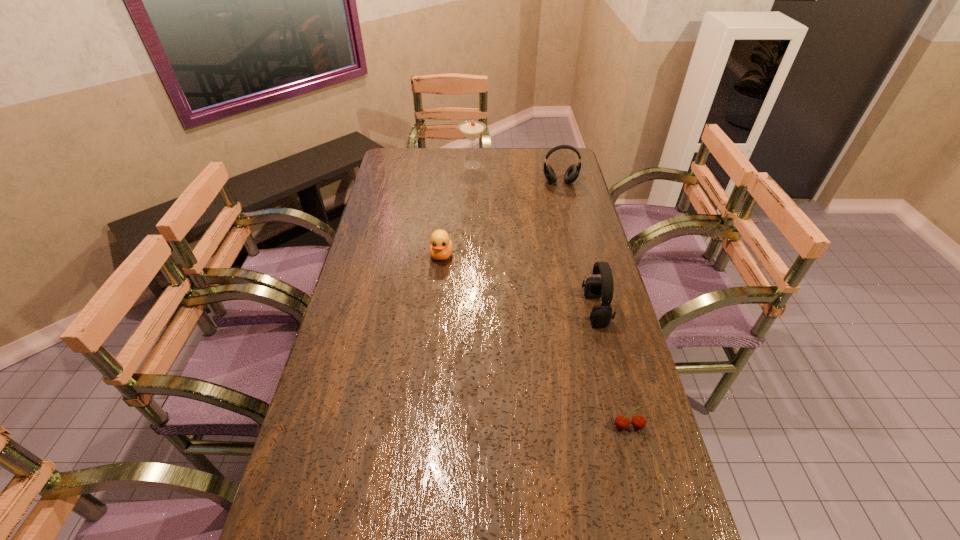
Identify the location of vacant region at the far right corner of the desktop. The image size is (960, 540). (563, 160).

Find the location of a particular element. The image size is (960, 540). empty space that is in between the second farthest object and the martini is located at coordinates (516, 173).

In order to click on blank region between the leftmost object and the nearest object in this screenshot , I will do `click(535, 341)`.

Find the location of `free space that is in between the third nearest object and the farther headset`. free space that is in between the third nearest object and the farther headset is located at coordinates (501, 219).

Locate an element on the screen. vacant space in between the fourth nearest object and the cherry is located at coordinates (594, 304).

Where is `free spot between the second farthest object and the third nearest object`? free spot between the second farthest object and the third nearest object is located at coordinates (501, 219).

Where is `free space between the shortest object and the fourth nearest object`? This screenshot has width=960, height=540. free space between the shortest object and the fourth nearest object is located at coordinates (594, 304).

Find the location of `vacant area that lies between the shortest object and the duckling`. vacant area that lies between the shortest object and the duckling is located at coordinates (535, 341).

Identify which object is the closest to the duckling. Please provide its 2D coordinates. Your answer should be formatted as a tuple, i.e. [(x, y)], where the tuple contains the x and y coordinates of a point satisfying the conditions above.

[(595, 287)]

Locate an element on the screen. This screenshot has height=540, width=960. object that is the second closest to the martini is located at coordinates (441, 247).